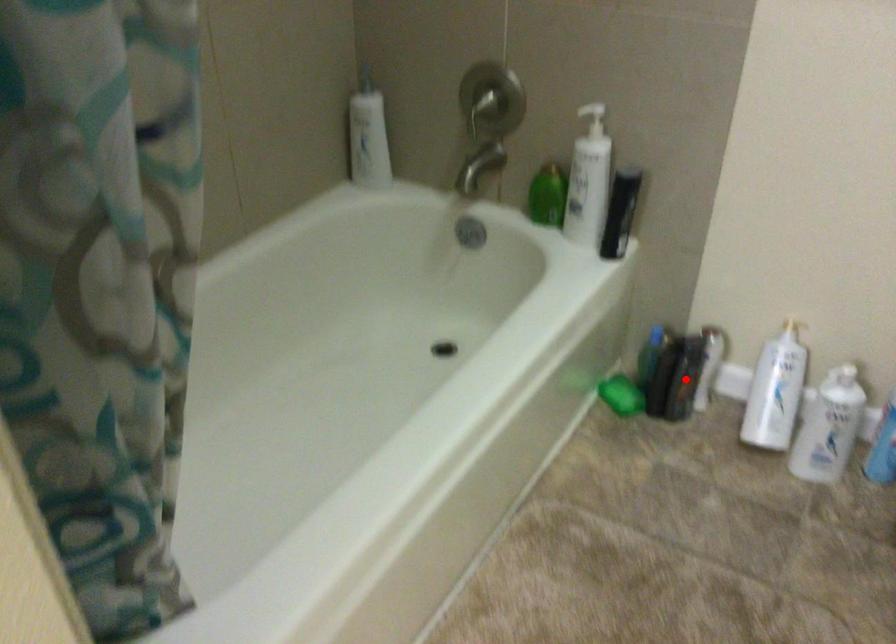
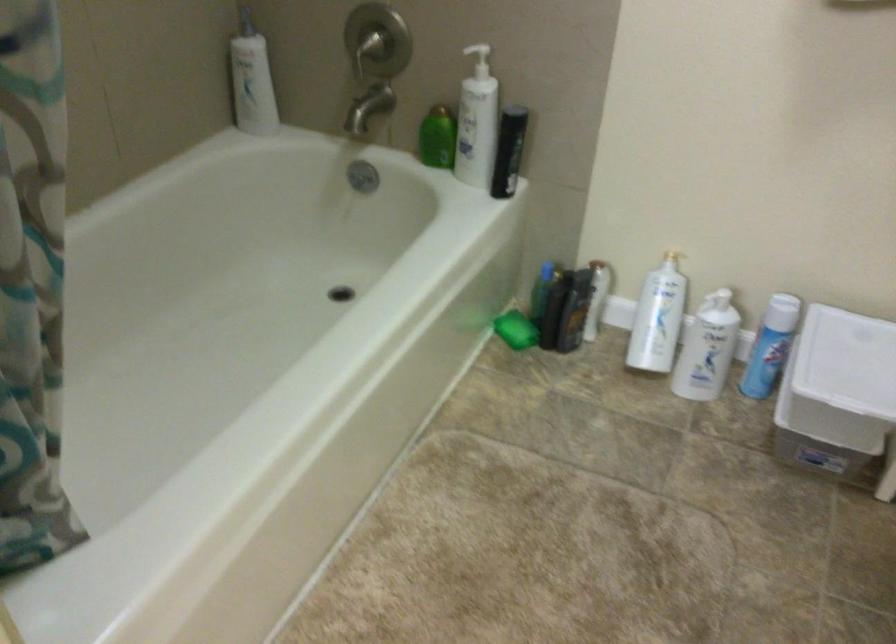
In the second image, find the point that corresponds to the highlighted location in the first image.

(574, 310)